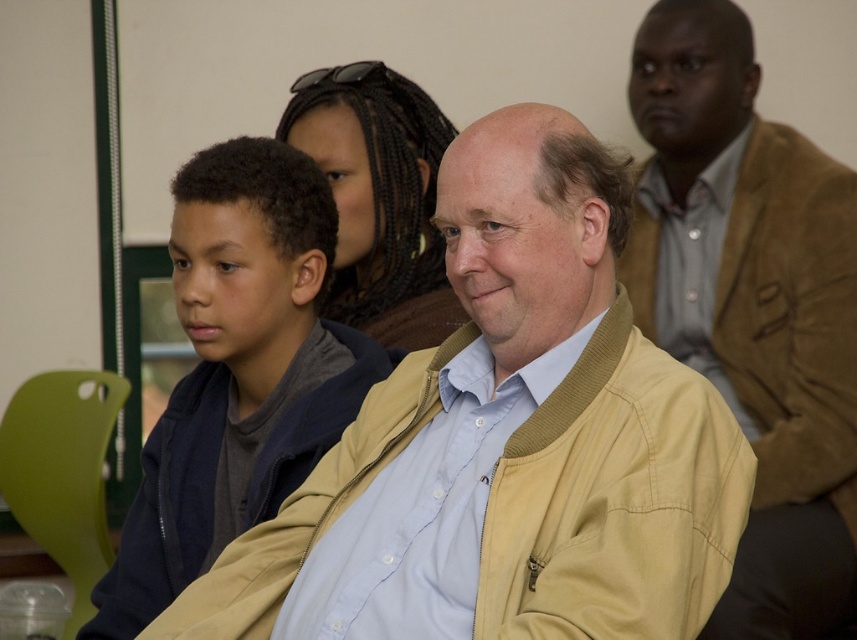
Between brown leather jacket at upper right and brown braided hair at center, which one has less height?

Standing shorter between the two is brown braided hair at center.

Is brown leather jacket at upper right to the left of brown braided hair at center from the viewer's perspective?

In fact, brown leather jacket at upper right is to the right of brown braided hair at center.

You are a GUI agent. You are given a task and a screenshot of the screen. Output one action in this format:
    pyautogui.click(x=<x>, y=<y>)
    Task: Click on the brown leather jacket at upper right
    Image resolution: width=857 pixels, height=640 pixels.
    Given the screenshot: What is the action you would take?
    pyautogui.click(x=752, y=305)

Where is `brown leather jacket at upper right`? brown leather jacket at upper right is located at coordinates (752, 305).

Is light beige jacket at center shorter than dark blue jacket at left?

Yes.

Image resolution: width=857 pixels, height=640 pixels. In order to click on light beige jacket at center in this screenshot , I will do `click(506, 445)`.

Locate an element on the screen. This screenshot has height=640, width=857. light beige jacket at center is located at coordinates (506, 445).

Does brown leather jacket at upper right have a larger size compared to dark blue jacket at left?

Yes, brown leather jacket at upper right is bigger than dark blue jacket at left.

Who is more forward, [663,90] or [201,368]?

Point [201,368] is in front.

Where is `brown leather jacket at upper right`? Image resolution: width=857 pixels, height=640 pixels. brown leather jacket at upper right is located at coordinates (752, 305).

The height and width of the screenshot is (640, 857). What are the coordinates of `brown leather jacket at upper right` in the screenshot? It's located at (752, 305).